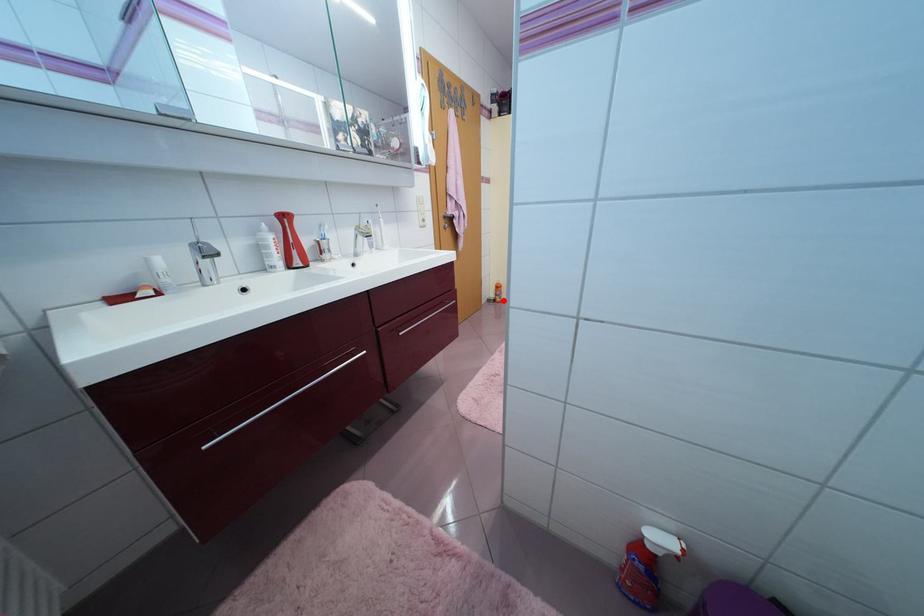
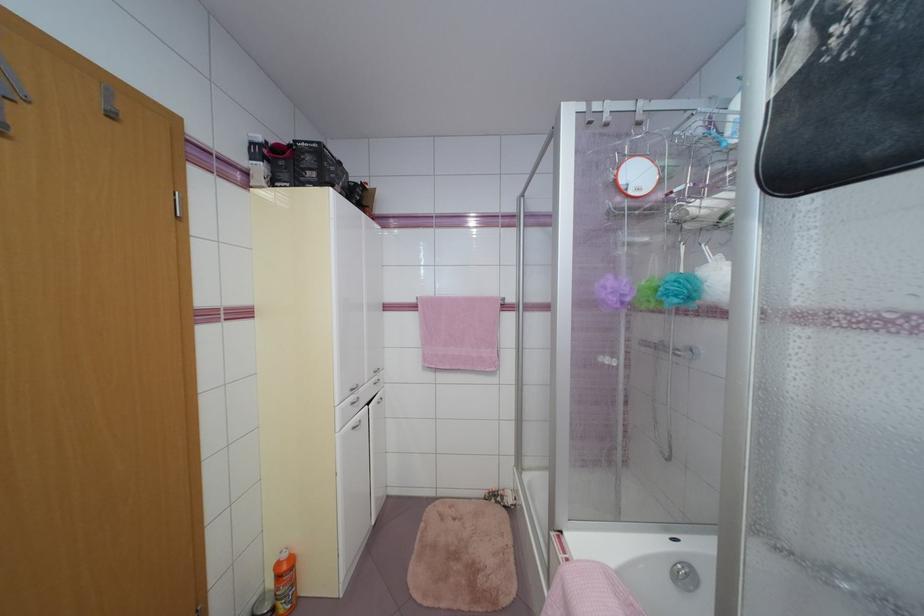
Question: I am providing you with two images of the same scene from different viewpoints. A red point is shown in image1. For the corresponding object point in image2, is it positioned nearer or farther from the camera?

Choices:
 (A) Nearer
 (B) Farther

Answer: (B)